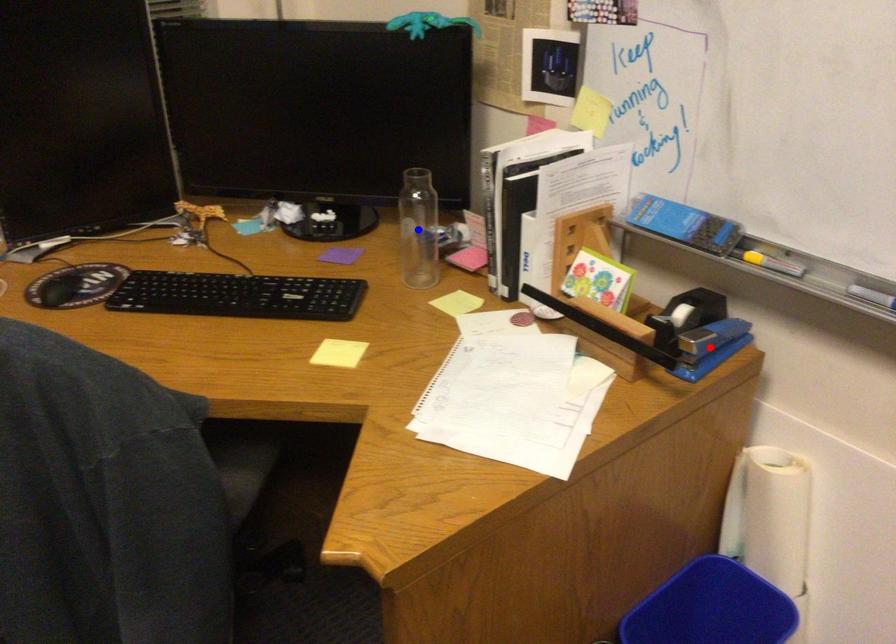
Question: In the image, two points are highlighted. Which point is nearer to the camera? Reply with the corresponding letter.

Choices:
 (A) blue point
 (B) red point

Answer: (B)